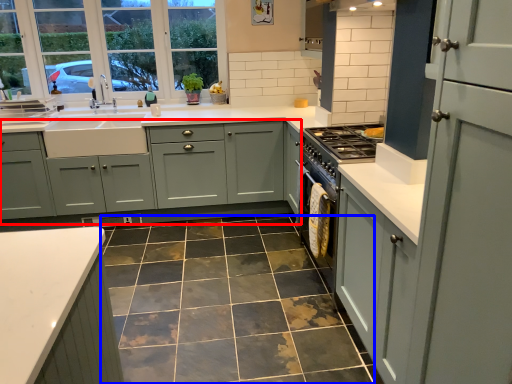
Question: Among these objects, which one is farthest to the camera, cabinetry (highlighted by a red box) or ceramic tile (highlighted by a blue box)?

Choices:
 (A) cabinetry
 (B) ceramic tile

Answer: (A)